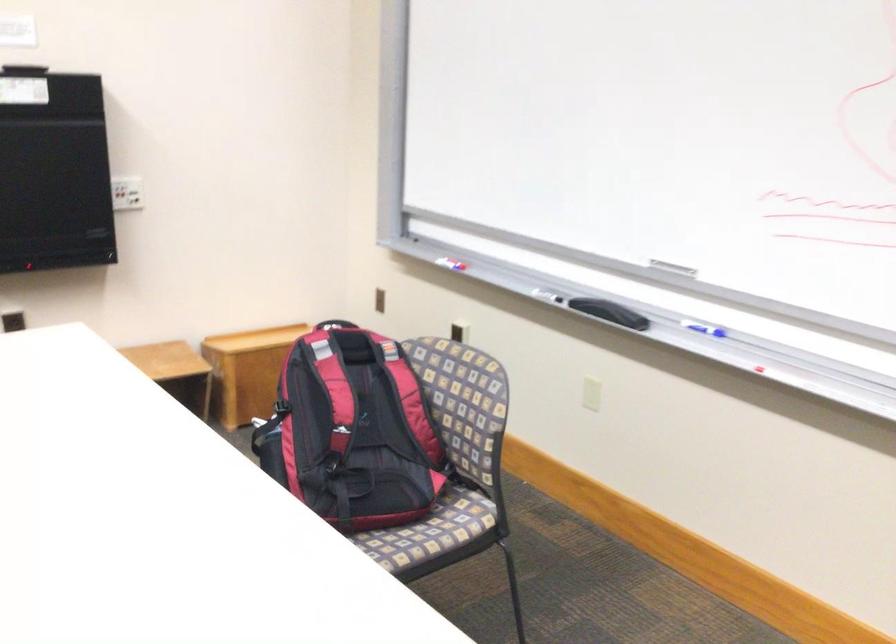
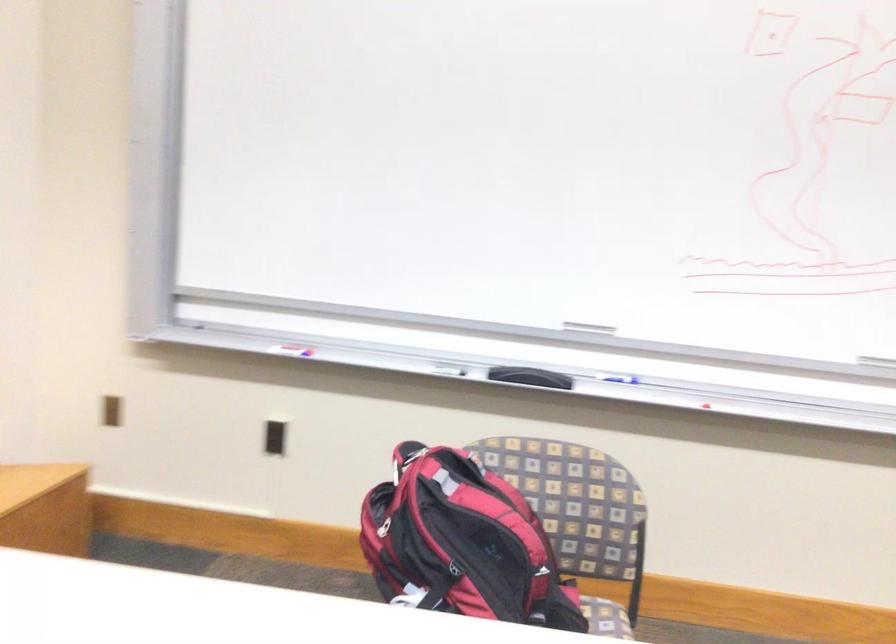
Find the pixel in the second image that matches point 604,308 in the first image.

(530, 377)